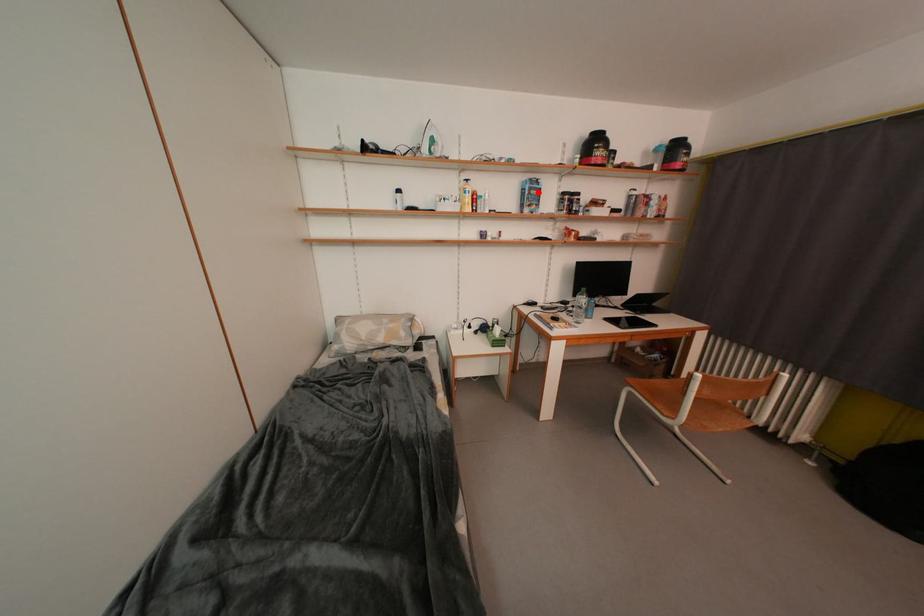
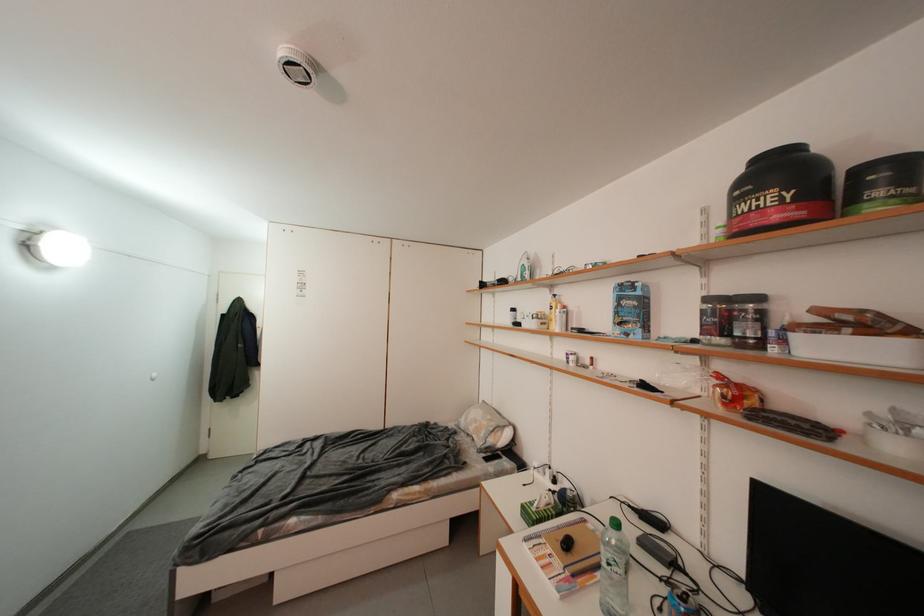
Where in the second image is the point corresponding to the highlighted location from the first image?

(627, 302)